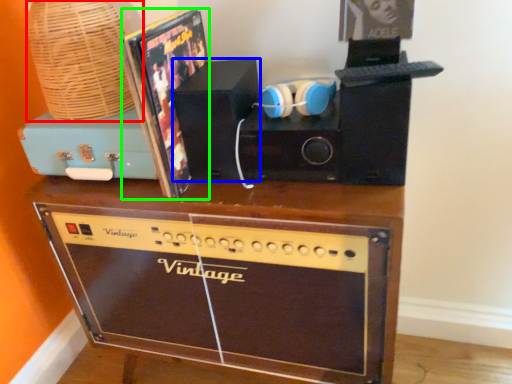
Question: Which object is positioned farthest from basket (highlighted by a red box)? Select from speaker (highlighted by a blue box) and album cover (highlighted by a green box).

Choices:
 (A) speaker
 (B) album cover

Answer: (A)